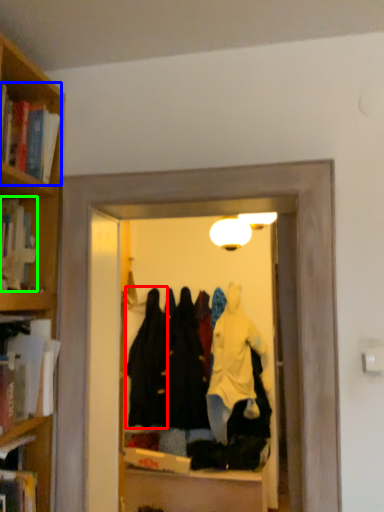
Question: Based on their relative distances, which object is farther from clothing (highlighted by a red box)? Choose from book (highlighted by a blue box) and book (highlighted by a green box).

Choices:
 (A) book
 (B) book

Answer: (A)